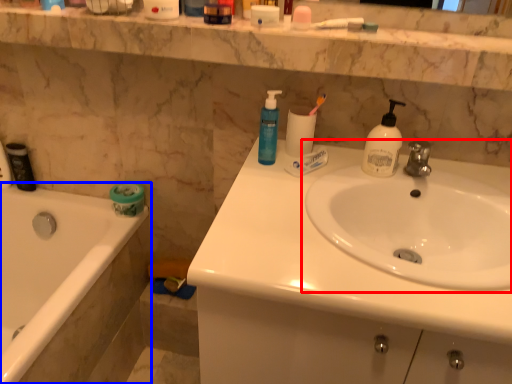
Question: Which object appears closest to the camera in this image, sink (highlighted by a red box) or bathtub (highlighted by a blue box)?

Choices:
 (A) sink
 (B) bathtub

Answer: (A)